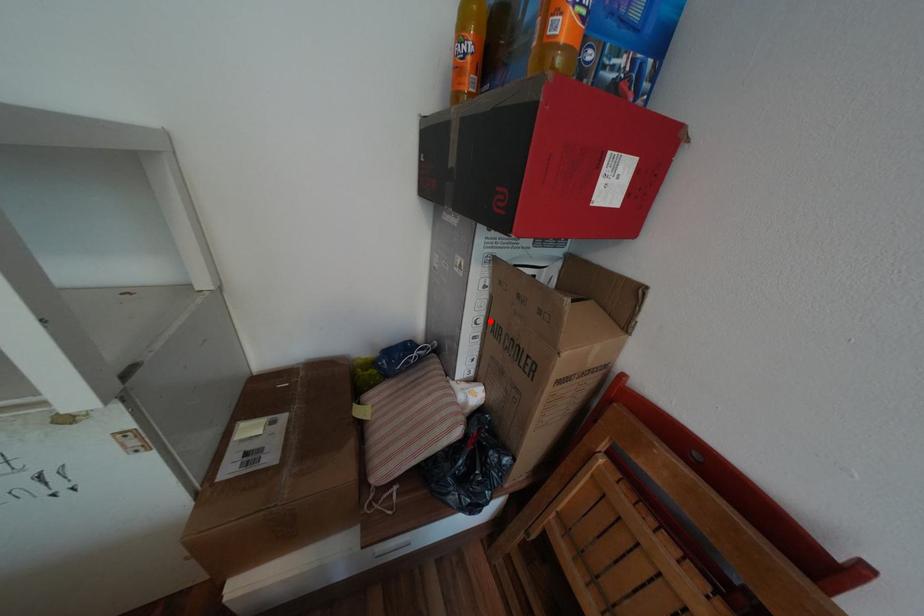
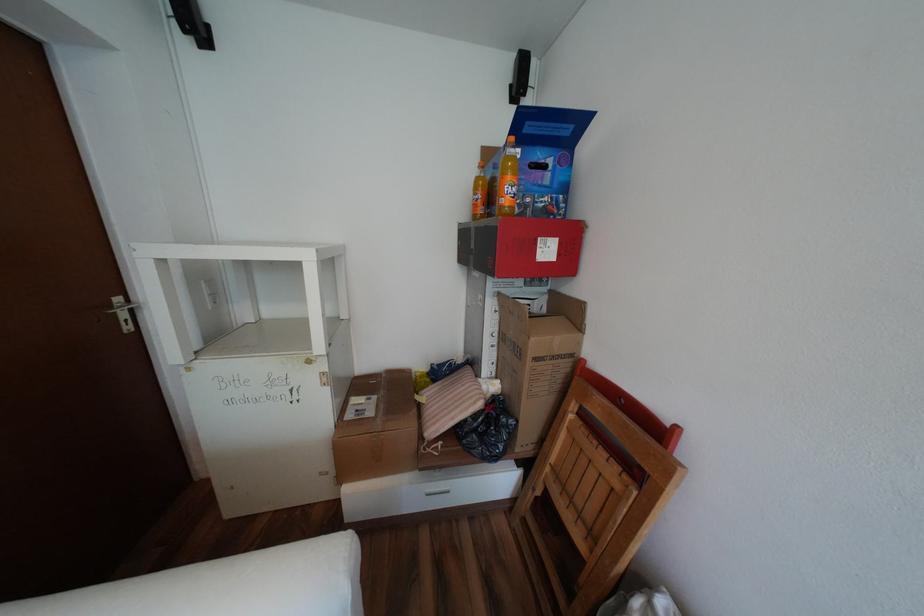
The point at the highlighted location is marked in the first image. Where is the corresponding point in the second image?

(505, 334)